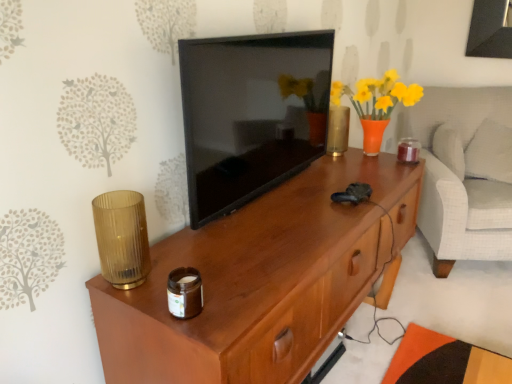
Locate an element on the screen. The width and height of the screenshot is (512, 384). free location in front of black glossy tv at center is located at coordinates (260, 229).